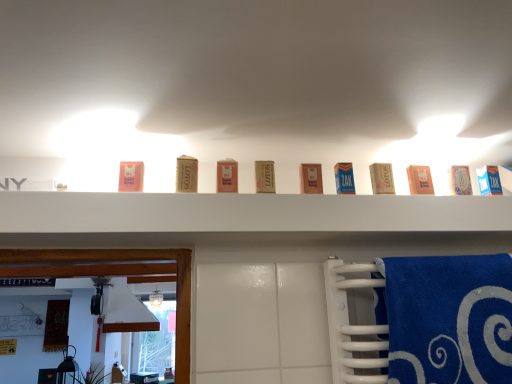
Locate an element on the screen. matte orange carton at center, placed as the eighth product when sorted from right to left is located at coordinates (227, 176).

The image size is (512, 384). What are the coordinates of `matte brown soap at center, which is the second product from left to right` in the screenshot? It's located at (187, 174).

Describe the element at coordinates (489, 180) in the screenshot. I see `blue cardboard box at upper right, which is the 1th product from right to left` at that location.

Locate an element on the screen. white cardboard box at upper center, which is the 2th product in right-to-left order is located at coordinates (459, 180).

What do you see at coordinates (459, 180) in the screenshot? The image size is (512, 384). I see `white cardboard box at upper center, which is the 2th product in right-to-left order` at bounding box center [459, 180].

Measure the distance between point (326, 204) and camera.

Point (326, 204) and camera are 38.78 inches apart.

This screenshot has height=384, width=512. In order to click on matte cardboard box at center, the fourth product in the left-to-right sequence in this screenshot , I will do `click(265, 177)`.

The width and height of the screenshot is (512, 384). What do you see at coordinates (382, 178) in the screenshot?
I see `matte gold box at center, marked as the fourth product in a right-to-left arrangement` at bounding box center [382, 178].

Consider the image. What is the approximate width of matte gold box at center, the seventh product positioned from the left?

matte gold box at center, the seventh product positioned from the left, is 1.26 inches wide.

You are a GUI agent. You are given a task and a screenshot of the screen. Output one action in this format:
    pyautogui.click(x=<x>, y=<y>)
    Task: Click on the matte orange carton at center, placed as the eighth product when sorted from right to left
    
    Given the screenshot: What is the action you would take?
    pyautogui.click(x=227, y=176)

From the image's perspective, is blue cardboard box at center, which appears as the fifth product when viewed from the right, on top of white cardboard box at upper center, which is the 2th product in right-to-left order?

No, from the image's perspective, blue cardboard box at center, which appears as the fifth product when viewed from the right, is not above white cardboard box at upper center, which is the 2th product in right-to-left order.

Is blue cardboard box at center, which appears as the fifth product when viewed from the right, surrounding white cardboard box at upper center, which is the 2th product in right-to-left order?

That's incorrect, white cardboard box at upper center, which is the 2th product in right-to-left order, is not inside blue cardboard box at center, which appears as the fifth product when viewed from the right.

What's the angular difference between blue cardboard box at center, positioned as the sixth product in left-to-right order, and white cardboard box at upper center, which is the 2th product in right-to-left order,'s facing directions?

0.0102 degrees separate the facing orientations of blue cardboard box at center, positioned as the sixth product in left-to-right order, and white cardboard box at upper center, which is the 2th product in right-to-left order.

Based on the photo, from the image's perspective, which is below, matte orange carton at center, acting as the third product starting from the left, or matte brown soap at center, which is the second product from left to right?

matte orange carton at center, acting as the third product starting from the left, from the image's perspective.

From a real-world perspective, is matte orange carton at center, acting as the third product starting from the left, above or below matte brown soap at center, placed as the 9th product when sorted from right to left?

In terms of real-world spatial position, matte orange carton at center, acting as the third product starting from the left, is below matte brown soap at center, placed as the 9th product when sorted from right to left.

Can you tell me how much matte orange carton at center, placed as the eighth product when sorted from right to left, and matte brown soap at center, which is the second product from left to right, differ in facing direction?

0.00998 degrees separate the facing orientations of matte orange carton at center, placed as the eighth product when sorted from right to left, and matte brown soap at center, which is the second product from left to right.

Is matte orange carton at center, acting as the third product starting from the left, in contact with matte brown soap at center, which is the second product from left to right?

Yes, matte orange carton at center, acting as the third product starting from the left, is touching matte brown soap at center, which is the second product from left to right.

How much distance is there between blue soft towel at right and blue cardboard box at center, which appears as the fifth product when viewed from the right?

blue soft towel at right and blue cardboard box at center, which appears as the fifth product when viewed from the right, are 13.64 inches apart.

Is blue soft towel at right taller than blue cardboard box at center, positioned as the sixth product in left-to-right order?

Indeed, blue soft towel at right has a greater height compared to blue cardboard box at center, positioned as the sixth product in left-to-right order.

How different are the orientations of blue soft towel at right and blue cardboard box at center, which appears as the fifth product when viewed from the right, in degrees?

The facing directions of blue soft towel at right and blue cardboard box at center, which appears as the fifth product when viewed from the right, are 0.334 degrees apart.

Is blue soft towel at right positioned behind blue cardboard box at center, which appears as the fifth product when viewed from the right?

No, blue soft towel at right is closer to the camera.

Is the position of blue cardboard box at center, which appears as the fifth product when viewed from the right, less distant than that of matte gold box at center, the seventh product positioned from the left?

Yes, it is in front of matte gold box at center, the seventh product positioned from the left.

I want to click on the 1st product above the blue cardboard box at center, positioned as the sixth product in left-to-right order (from the image's perspective), so click(382, 178).

Considering the relative sizes of blue cardboard box at center, positioned as the sixth product in left-to-right order, and matte gold box at center, the seventh product positioned from the left, in the image provided, is blue cardboard box at center, positioned as the sixth product in left-to-right order, bigger than matte gold box at center, the seventh product positioned from the left,?

No, blue cardboard box at center, positioned as the sixth product in left-to-right order, is not bigger than matte gold box at center, the seventh product positioned from the left.

Is matte cardboard box at center, which is counted as the 7th product, starting from the right, beside matte brown soap at center, which is the second product from left to right?

matte cardboard box at center, which is counted as the 7th product, starting from the right, is not next to matte brown soap at center, which is the second product from left to right, and they're not touching.

From the image's perspective, is matte cardboard box at center, which is counted as the 7th product, starting from the right, under matte brown soap at center, placed as the 9th product when sorted from right to left?

Yes, from the image's perspective, matte cardboard box at center, which is counted as the 7th product, starting from the right, is beneath matte brown soap at center, placed as the 9th product when sorted from right to left.

Considering the sizes of objects matte cardboard box at center, the fourth product in the left-to-right sequence, and matte brown soap at center, which is the second product from left to right, in the image provided, who is taller, matte cardboard box at center, the fourth product in the left-to-right sequence, or matte brown soap at center, which is the second product from left to right,?

Standing taller between the two is matte brown soap at center, which is the second product from left to right.

Which object is positioned more to the left, matte cardboard box at center, the fourth product in the left-to-right sequence, or matte brown soap at center, which is the second product from left to right?

Positioned to the left is matte brown soap at center, which is the second product from left to right.

Which is behind, point (388, 179) or point (337, 192)?

The point (388, 179) is behind.

Is matte gold box at center, the seventh product positioned from the left, inside or outside of blue cardboard box at center, which appears as the fifth product when viewed from the right?

matte gold box at center, the seventh product positioned from the left, is located beyond the bounds of blue cardboard box at center, which appears as the fifth product when viewed from the right.

Which object is wider, matte gold box at center, marked as the fourth product in a right-to-left arrangement, or blue cardboard box at center, positioned as the sixth product in left-to-right order?

Wider between the two is matte gold box at center, marked as the fourth product in a right-to-left arrangement.

Between matte gold box at center, marked as the fourth product in a right-to-left arrangement, and blue cardboard box at center, positioned as the sixth product in left-to-right order, which one appears on the right side from the viewer's perspective?

Positioned to the right is matte gold box at center, marked as the fourth product in a right-to-left arrangement.

Does pink matte soap at upper center, positioned as the tenth product in right-to-left order, have a greater width compared to white cardboard box at upper center, placed as the ninth product when sorted from left to right?

Incorrect, the width of pink matte soap at upper center, positioned as the tenth product in right-to-left order, does not surpass that of white cardboard box at upper center, placed as the ninth product when sorted from left to right.

From a real-world perspective, which object stands above the other?

white cardboard box at upper center, which is the 2th product in right-to-left order, from a real-world perspective.

Is pink matte soap at upper center, the first product viewed from the left, to the left of white cardboard box at upper center, which is the 2th product in right-to-left order, from the viewer's perspective?

Yes.

Starting from the blue cardboard box at center, which appears as the fifth product when viewed from the right, which product is the 3rd one to the right? Please provide its 2D coordinates.

[(459, 180)]

The height and width of the screenshot is (384, 512). Find the location of `the 1st product directly beneath the matte brown soap at center, placed as the 9th product when sorted from right to left (from a real-world perspective)`. the 1st product directly beneath the matte brown soap at center, placed as the 9th product when sorted from right to left (from a real-world perspective) is located at coordinates (227, 176).

Considering their positions, is matte cardboard box at center, which is counted as the 7th product, starting from the right, positioned closer to matte gold box at center, marked as the fourth product in a right-to-left arrangement, than blue cardboard box at upper right, which is the 1th product from right to left?

The object closer to matte gold box at center, marked as the fourth product in a right-to-left arrangement, is blue cardboard box at upper right, which is the 1th product from right to left.

Considering their positions, is matte gold box at center, marked as the fourth product in a right-to-left arrangement, positioned closer to blue soft towel at right than blue cardboard box at upper right, which is the 1th product from right to left?

Based on the image, matte gold box at center, marked as the fourth product in a right-to-left arrangement, appears to be nearer to blue soft towel at right.

Estimate the real-world distances between objects in this image. Which object is closer to matte brown soap at center, placed as the 9th product when sorted from right to left, matte cardboard box at center, which is the 6th product in right-to-left order, or pink matte soap at upper center, positioned as the tenth product in right-to-left order?

Among the two, pink matte soap at upper center, positioned as the tenth product in right-to-left order, is located nearer to matte brown soap at center, placed as the 9th product when sorted from right to left.

When comparing their distances from pink matte soap at upper center, positioned as the tenth product in right-to-left order, does matte cardboard box at center, which is the 5th product from left to right, or matte brown soap at center, which is the second product from left to right, seem closer?

matte brown soap at center, which is the second product from left to right.

When comparing their distances from blue soft towel at right, does blue cardboard box at upper right, which is the 10th product in left-to-right order, or pink matte soap at upper center, positioned as the tenth product in right-to-left order, seem further?

pink matte soap at upper center, positioned as the tenth product in right-to-left order, lies further to blue soft towel at right than the other object.

When comparing their distances from matte cardboard box at center, which is the 6th product in right-to-left order, does white matte shelf at upper center or matte orange carton at center, placed as the eighth product when sorted from right to left, seem further?

white matte shelf at upper center is further to matte cardboard box at center, which is the 6th product in right-to-left order.

Looking at the image, which one is located closer to matte brown soap at center, placed as the 9th product when sorted from right to left, white matte shelf at upper center or white cardboard box at upper center, which is the 2th product in right-to-left order?

white matte shelf at upper center lies closer to matte brown soap at center, placed as the 9th product when sorted from right to left, than the other object.

From the image, which object appears to be nearer to white cardboard box at upper center, placed as the ninth product when sorted from left to right, pink cardboard box at center, which is the eighth product in left-to-right order, or matte cardboard box at center, which is the 6th product in right-to-left order?

Among the two, pink cardboard box at center, which is the eighth product in left-to-right order, is located nearer to white cardboard box at upper center, placed as the ninth product when sorted from left to right.

The image size is (512, 384). Find the location of `product between matte gold box at center, marked as the fourth product in a right-to-left arrangement, and white cardboard box at upper center, which is the 2th product in right-to-left order, in the horizontal direction`. product between matte gold box at center, marked as the fourth product in a right-to-left arrangement, and white cardboard box at upper center, which is the 2th product in right-to-left order, in the horizontal direction is located at coordinates (420, 180).

At what (x,y) coordinates should I click in order to perform the action: click on bath towel between matte brown soap at center, which is the second product from left to right, and white cardboard box at upper center, which is the 2th product in right-to-left order. Please return your answer as a coordinate pair (x, y). The image size is (512, 384). Looking at the image, I should click on (429, 321).

Locate an element on the screen. shelf between matte cardboard box at center, which is counted as the 7th product, starting from the right, and blue soft towel at right is located at coordinates (249, 213).

Where is `bath towel between pink matte soap at upper center, positioned as the tenth product in right-to-left order, and white cardboard box at upper center, which is the 2th product in right-to-left order, in the horizontal direction`? The image size is (512, 384). bath towel between pink matte soap at upper center, positioned as the tenth product in right-to-left order, and white cardboard box at upper center, which is the 2th product in right-to-left order, in the horizontal direction is located at coordinates (429, 321).